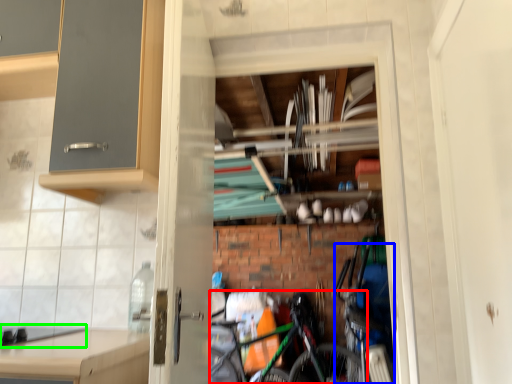
Question: Which is farther away from bicycle (highlighted by a red box)? bicycle (highlighted by a blue box) or gas stove (highlighted by a green box)?

Choices:
 (A) bicycle
 (B) gas stove

Answer: (B)